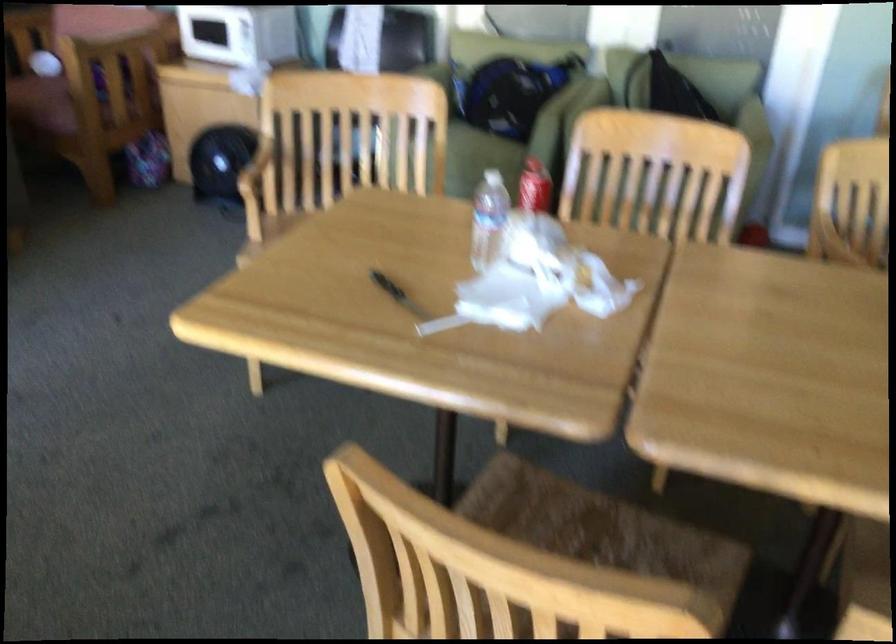
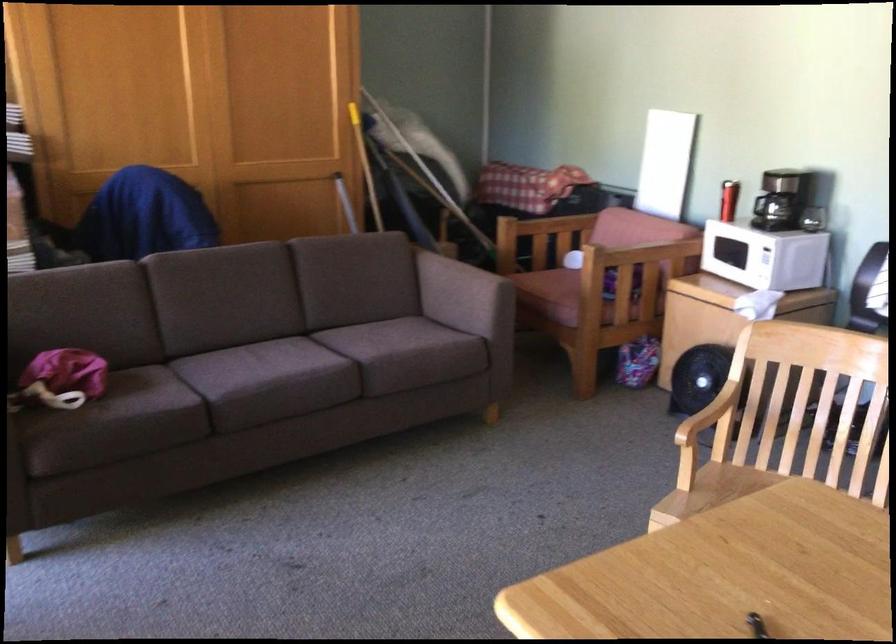
Question: Based on the continuous images, in which direction is the camera rotating? Reply with the corresponding letter.

Choices:
 (A) Left
 (B) Right
 (C) Up
 (D) Down

Answer: (A)